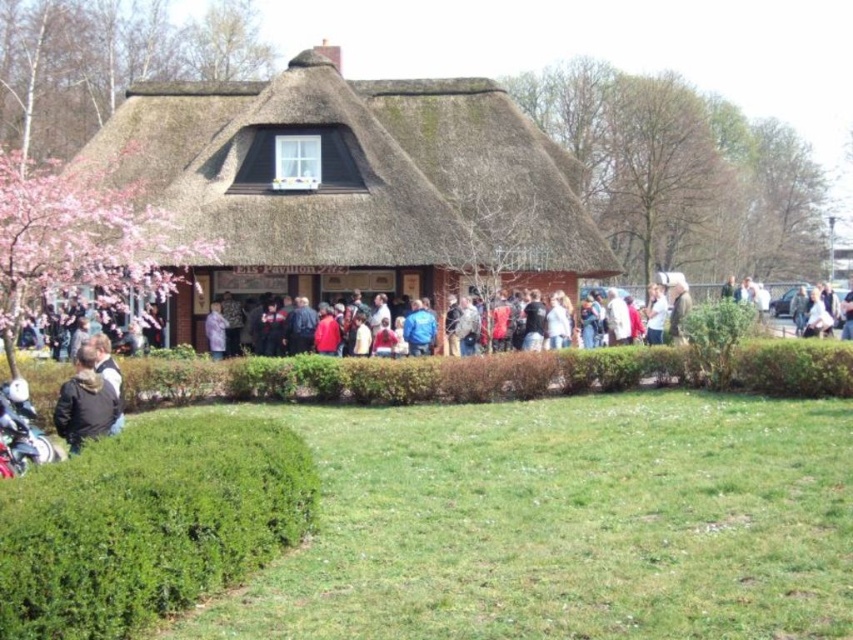
You are standing at the entrance of the thatched roof cottage at center. Which direction should you face to see the point marked at coordinates (349, 184)?

The thatched roof cottage at center is represented by point (349, 184), so facing the direction of the point marked at (349, 184) would mean facing the cottage itself since the point corresponds to its location.

You are standing at the camera position looking at the point at coordinates point (212,275). If you walk straight towards that point, how far will you have to walk to reach it?

You will have to walk 37.90 meters to reach the point (212,275) from the camera position.